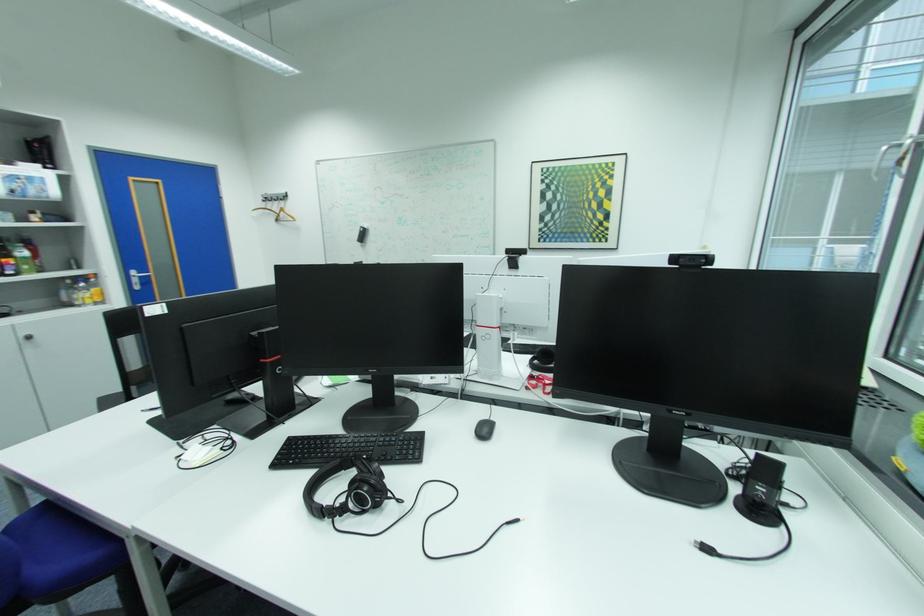
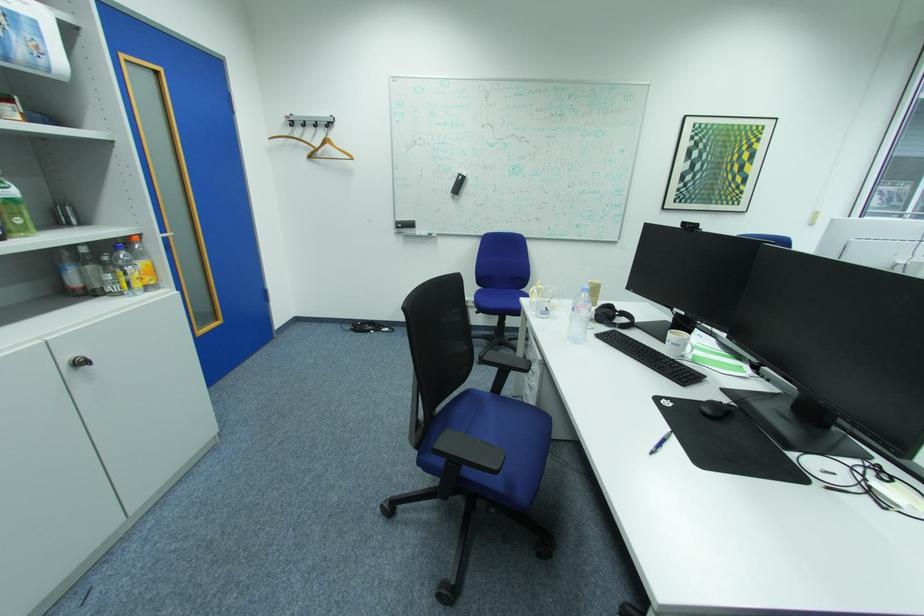
Which direction would the cameraman need to move to produce the second image?

The cameraman moved toward left, forward.